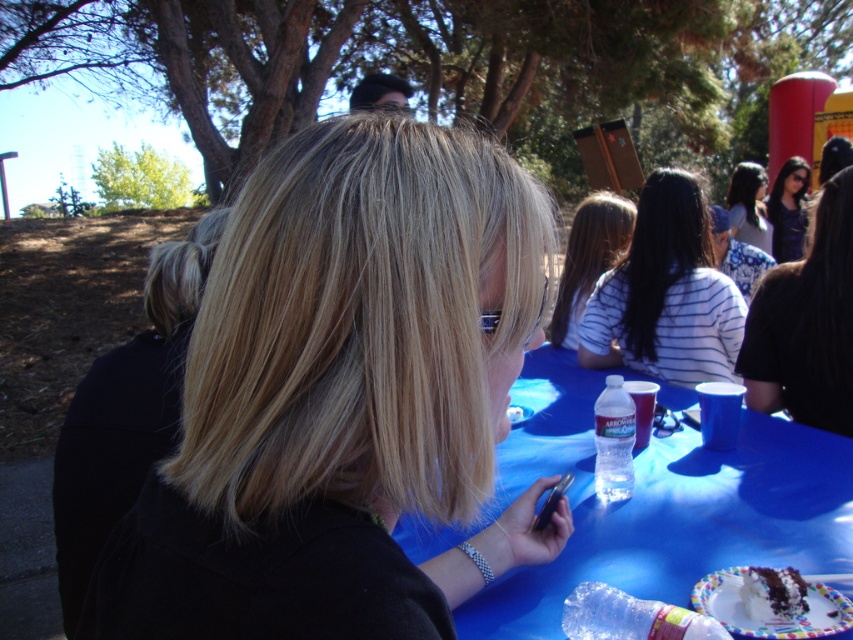
Question: Can you confirm if white striped shirt at center is bigger than clear plastic bottle at lower center?

Choices:
 (A) no
 (B) yes

Answer: (B)

Question: Which object is closer to the camera taking this photo?

Choices:
 (A) chocolate frosted cake at lower right
 (B) clear plastic water bottle at center

Answer: (A)

Question: Which of the following is the closest to the observer?

Choices:
 (A) chocolate frosted cake at lower right
 (B) striped fabric shirt at center

Answer: (A)

Question: Based on their relative distances, which object is farther from the dark brown hair at upper right?

Choices:
 (A) clear plastic water bottle at center
 (B) dark blue fabric shirt at upper right
 (C) matte black hair at upper center
 (D) blonde smooth hair at center

Answer: (B)

Question: Is dark brown hair at upper right positioned behind chocolate frosted cake at lower right?

Choices:
 (A) yes
 (B) no

Answer: (A)

Question: Does chocolate frosted cake at lower right appear on the left side of matte black hair at upper center?

Choices:
 (A) no
 (B) yes

Answer: (B)